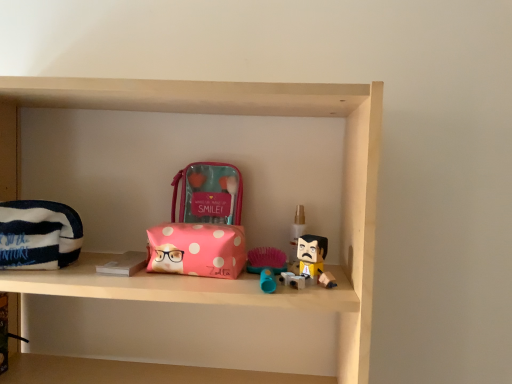
Question: Can you confirm if pink polka dot pouch at center, marked as the first pouch in a right-to-left arrangement, is bigger than striped fabric pouch at left, marked as the 2th pouch in a right-to-left arrangement?

Choices:
 (A) no
 (B) yes

Answer: (A)

Question: Does pink polka dot pouch at center, which appears as the second pouch when viewed from the front, come behind striped fabric pouch at left, which ranks as the 2th pouch in top-to-bottom order?

Choices:
 (A) yes
 (B) no

Answer: (A)

Question: Is pink polka dot pouch at center, which is the 2th pouch in left-to-right order, positioned in front of striped fabric pouch at left, arranged as the 1th pouch when ordered from the bottom?

Choices:
 (A) no
 (B) yes

Answer: (A)

Question: Is pink polka dot pouch at center, the first pouch positioned from the back, facing towards striped fabric pouch at left, arranged as the 1th pouch when ordered from the bottom?

Choices:
 (A) yes
 (B) no

Answer: (B)

Question: From a real-world perspective, is pink polka dot pouch at center, acting as the 2th pouch starting from the bottom, positioned over striped fabric pouch at left, marked as the 2th pouch in a right-to-left arrangement, based on gravity?

Choices:
 (A) yes
 (B) no

Answer: (A)

Question: Is pink polka dot pouch at center, which appears as the second pouch when viewed from the front, wider than striped fabric pouch at left, which ranks as the 2th pouch in top-to-bottom order?

Choices:
 (A) yes
 (B) no

Answer: (B)

Question: Considering the relative sizes of striped fabric pouch at left, marked as the 2th pouch in a right-to-left arrangement, and pink polka dot fabric pouch at center in the image provided, is striped fabric pouch at left, marked as the 2th pouch in a right-to-left arrangement, thinner than pink polka dot fabric pouch at center?

Choices:
 (A) yes
 (B) no

Answer: (A)

Question: Does striped fabric pouch at left, positioned as the second pouch in back-to-front order, have a larger size compared to pink polka dot fabric pouch at center?

Choices:
 (A) no
 (B) yes

Answer: (B)

Question: Considering the relative sizes of striped fabric pouch at left, which ranks as the 2th pouch in top-to-bottom order, and pink polka dot fabric pouch at center in the image provided, is striped fabric pouch at left, which ranks as the 2th pouch in top-to-bottom order, taller than pink polka dot fabric pouch at center?

Choices:
 (A) no
 (B) yes

Answer: (B)

Question: Is striped fabric pouch at left, positioned as the second pouch in back-to-front order, outside pink polka dot fabric pouch at center?

Choices:
 (A) no
 (B) yes

Answer: (B)

Question: Does striped fabric pouch at left, which ranks as the 2th pouch in top-to-bottom order, have a smaller size compared to pink polka dot fabric pouch at center?

Choices:
 (A) no
 (B) yes

Answer: (A)

Question: Is striped fabric pouch at left, marked as the 2th pouch in a right-to-left arrangement, placed right next to pink polka dot fabric pouch at center?

Choices:
 (A) yes
 (B) no

Answer: (B)

Question: Is pink polka dot pouch at center, marked as the first pouch in a right-to-left arrangement, surrounded by translucent plastic spray bottle at center?

Choices:
 (A) yes
 (B) no

Answer: (B)